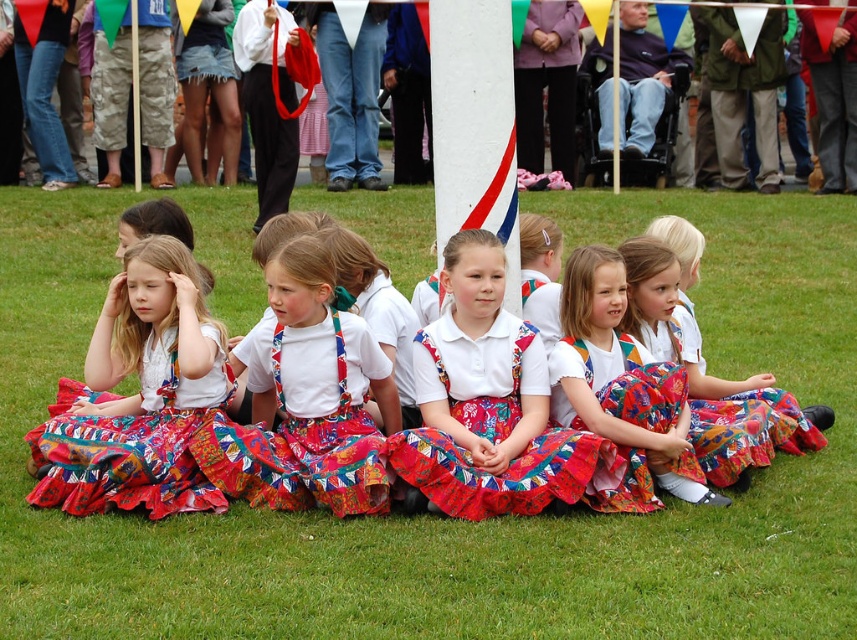
Question: Can you confirm if green grass at center is smaller than multicolored fabric dress at center?

Choices:
 (A) yes
 (B) no

Answer: (B)

Question: Is green grass at center in front of multicolored fabric dress at center?

Choices:
 (A) yes
 (B) no

Answer: (A)

Question: Can you confirm if floral cotton dress at center is thinner than multicolored fabric dress at center?

Choices:
 (A) no
 (B) yes

Answer: (A)

Question: Among these points, which one is farthest from the camera?

Choices:
 (A) (676, 474)
 (B) (470, 324)
 (C) (48, 566)

Answer: (B)

Question: Considering the real-world distances, which object is closest to the multicolored fabric dress at center?

Choices:
 (A) green grass at center
 (B) floral cotton dress at center

Answer: (B)

Question: Which of the following is the farthest from the observer?

Choices:
 (A) green grass at center
 (B) floral cotton dress at center

Answer: (B)